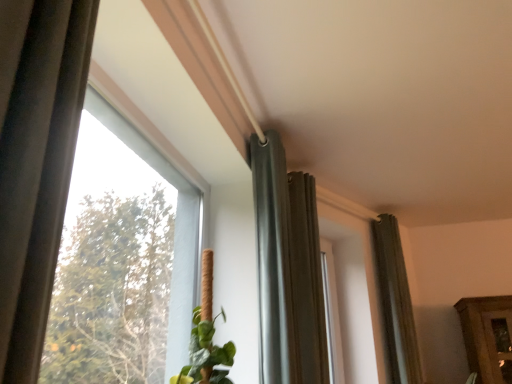
Question: Considering the relative positions of matte gray curtain at center, which appears as the 2th curtain when viewed from the front, and dark gray fabric curtain at center, positioned as the third curtain in right-to-left order, in the image provided, is matte gray curtain at center, which appears as the 2th curtain when viewed from the front, to the left or to the right of dark gray fabric curtain at center, positioned as the third curtain in right-to-left order,?

Choices:
 (A) right
 (B) left

Answer: (A)

Question: Is matte gray curtain at center, the second curtain when ordered from back to front, spatially inside dark gray fabric curtain at center, which ranks as the 1th curtain in front-to-back order, or outside of it?

Choices:
 (A) outside
 (B) inside

Answer: (A)

Question: Estimate the real-world distances between objects in this image. Which object is farther from the matte gray curtain at center, which appears as the 2th curtain when viewed from the front?

Choices:
 (A) dark gray fabric curtain at center, the first curtain when ordered from left to right
 (B) dark gray fabric curtain at right, the 3th curtain viewed from the left
 (C) transparent glass window at upper left

Answer: (C)

Question: Based on their relative distances, which object is farther from the matte gray curtain at center, the 2th curtain when ordered from left to right?

Choices:
 (A) dark gray fabric curtain at center, the first curtain when ordered from left to right
 (B) dark gray fabric curtain at right, arranged as the 1th curtain when viewed from the right
 (C) transparent glass window at upper left

Answer: (C)